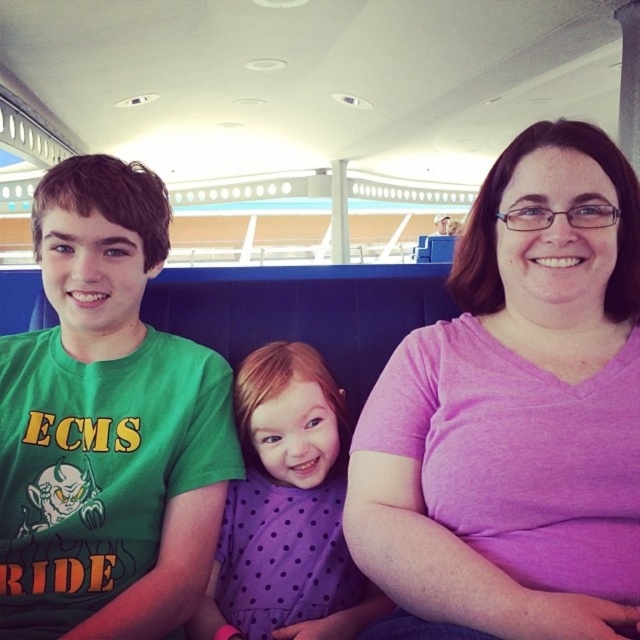
Question: Is purple cotton shirt at center positioned at the back of purple dotted dress at center?

Choices:
 (A) yes
 (B) no

Answer: (B)

Question: Is purple cotton shirt at center positioned behind purple dotted dress at center?

Choices:
 (A) yes
 (B) no

Answer: (B)

Question: Which object is positioned closest to the purple cotton shirt at center?

Choices:
 (A) green matte t-shirt at left
 (B) purple dotted dress at center

Answer: (B)

Question: Which object is positioned closest to the green matte t-shirt at left?

Choices:
 (A) purple dotted dress at center
 (B) purple cotton shirt at center

Answer: (A)

Question: Can you confirm if green matte t-shirt at left is bigger than purple dotted dress at center?

Choices:
 (A) no
 (B) yes

Answer: (B)

Question: Estimate the real-world distances between objects in this image. Which object is closer to the purple cotton shirt at center?

Choices:
 (A) purple dotted dress at center
 (B) green matte t-shirt at left

Answer: (A)